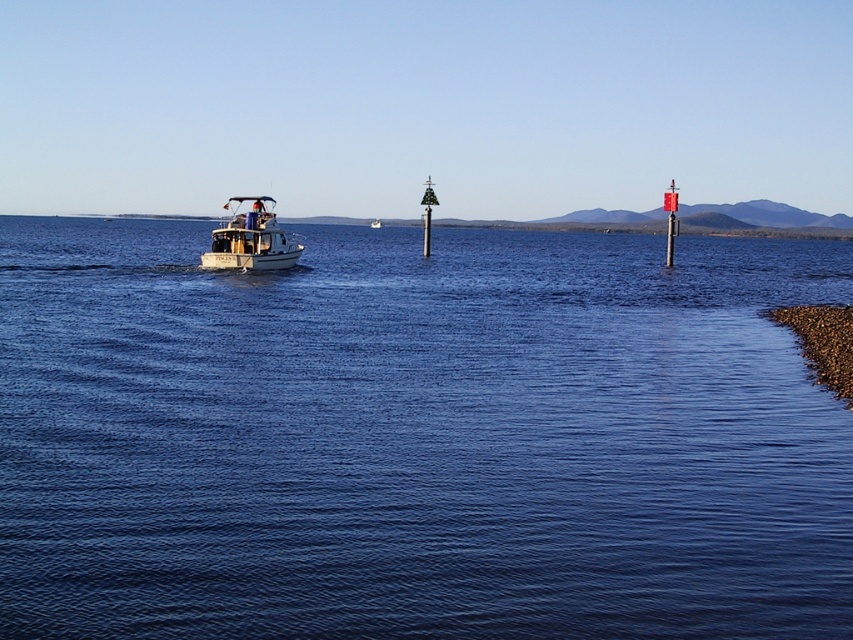
Is point (804, 605) farther from camera compared to point (279, 262)?

No.

Between blue water at center and white glossy boat at center-left, which one appears on the right side from the viewer's perspective?

blue water at center

Between point (773, 502) and point (270, 243), which one is positioned behind?

The point (270, 243) is behind.

You are a GUI agent. You are given a task and a screenshot of the screen. Output one action in this format:
    pyautogui.click(x=<x>, y=<y>)
    Task: Click on the blue water at center
    The height and width of the screenshot is (640, 853).
    Given the screenshot: What is the action you would take?
    pyautogui.click(x=416, y=436)